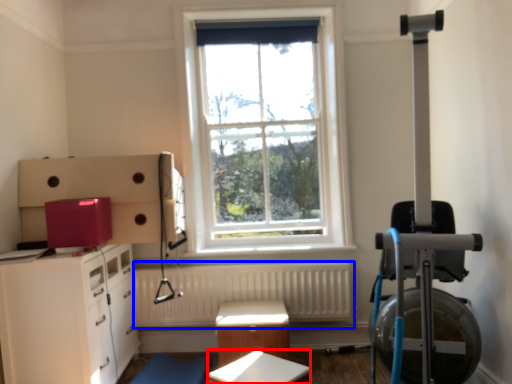
Question: Which of the following is the farthest to the observer, table (highlighted by a red box) or radiator (highlighted by a blue box)?

Choices:
 (A) table
 (B) radiator

Answer: (B)